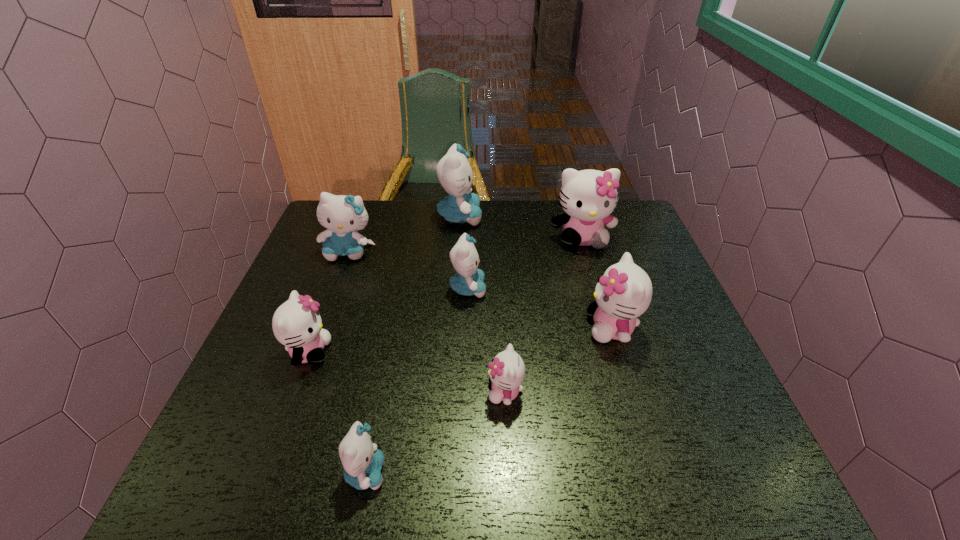
Choose which kitten is the seventh nearest neighbor to the farthest blue kitten. Please provide its 2D coordinates. Your answer should be formatted as a tuple, i.e. [(x, y)], where the tuple contains the x and y coordinates of a point satisfying the conditions above.

[(362, 461)]

Choose which kitten is the second nearest neighbor to the farthest white kitten. Please provide its 2D coordinates. Your answer should be formatted as a tuple, i.e. [(x, y)], where the tuple contains the x and y coordinates of a point satisfying the conditions above.

[(624, 292)]

Identify the location of blue kitten that stands as the closest to the farthest blue kitten. The height and width of the screenshot is (540, 960). (342, 215).

The image size is (960, 540). Find the location of `blue kitten that is the closest to the farthest blue kitten`. blue kitten that is the closest to the farthest blue kitten is located at coordinates (342, 215).

Identify which white kitten is the fourth closest to the third blue kitten from right to left. Please provide its 2D coordinates. Your answer should be formatted as a tuple, i.e. [(x, y)], where the tuple contains the x and y coordinates of a point satisfying the conditions above.

[(588, 197)]

This screenshot has width=960, height=540. What are the coordinates of `white kitten that stands as the closest to the second white kitten from left to right` in the screenshot? It's located at [x=624, y=292].

The height and width of the screenshot is (540, 960). Identify the location of vacant area in the image that satisfies the following two spatial constraints: 1. on the front-facing side of the biggest white kitten; 2. on the front-facing side of the smallest white kitten. (627, 392).

Locate an element on the screen. The image size is (960, 540). free space that satisfies the following two spatial constraints: 1. on the front-facing side of the biggest white kitten; 2. on the face of the nearest object is located at coordinates (651, 472).

Locate an element on the screen. free point that satisfies the following two spatial constraints: 1. on the front-facing side of the biggest white kitten; 2. on the face of the third farthest blue kitten is located at coordinates tap(596, 288).

Image resolution: width=960 pixels, height=540 pixels. In order to click on vacant space that satisfies the following two spatial constraints: 1. on the front-facing side of the biggest white kitten; 2. on the face of the second nearest blue kitten in this screenshot , I will do `click(596, 288)`.